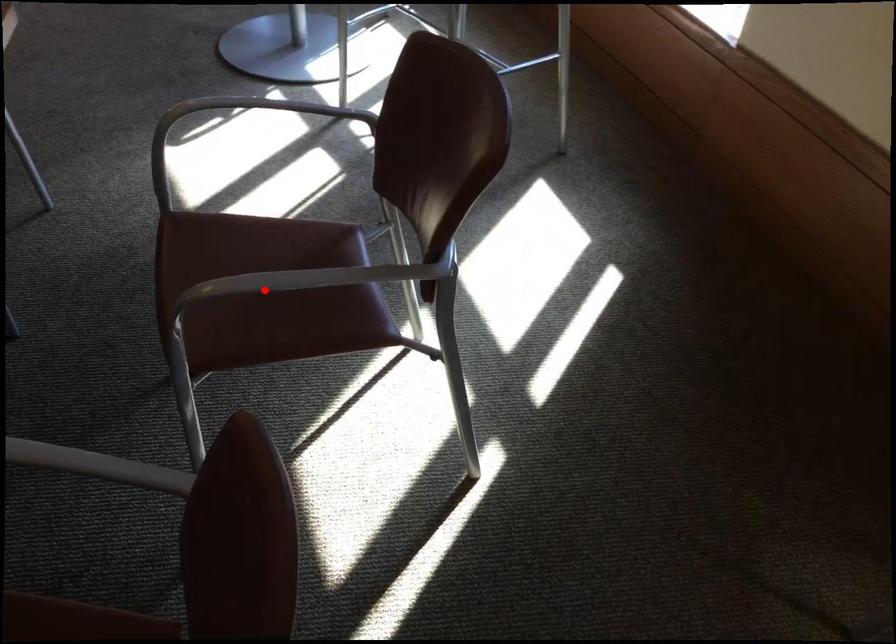
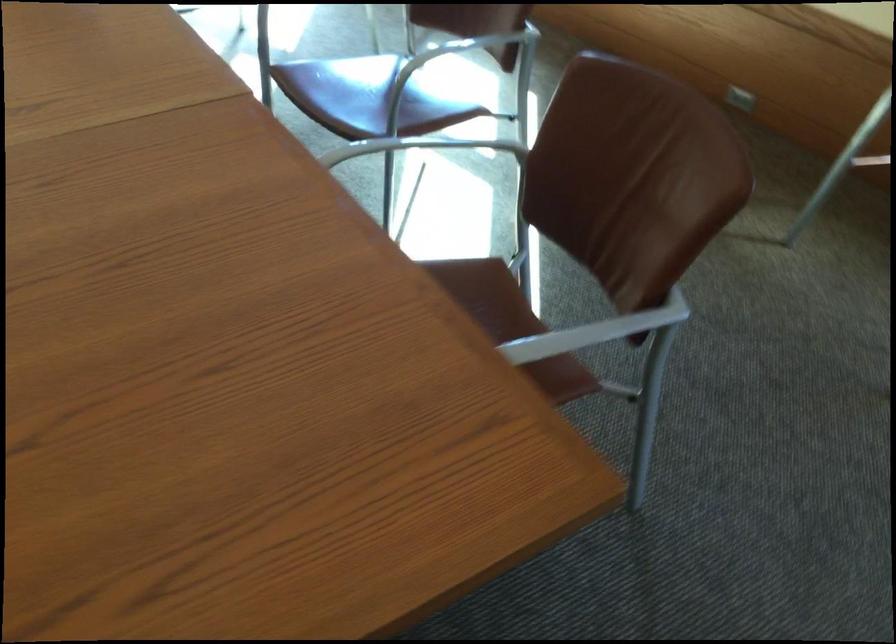
Question: I am providing you with two images of the same scene from different viewpoints. A red point is marked on the first image. At the location where the point appears in image 1, is it still visible in image 2?

Choices:
 (A) Yes
 (B) No

Answer: (B)